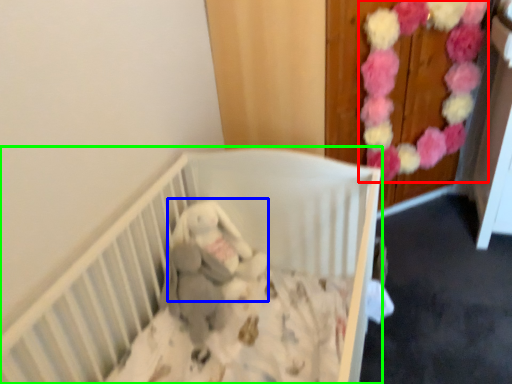
Question: Which object is positioned closest to flower (highlighted by a red box)? Select from baby elephant (highlighted by a blue box) and infant bed (highlighted by a green box).

Choices:
 (A) baby elephant
 (B) infant bed

Answer: (B)